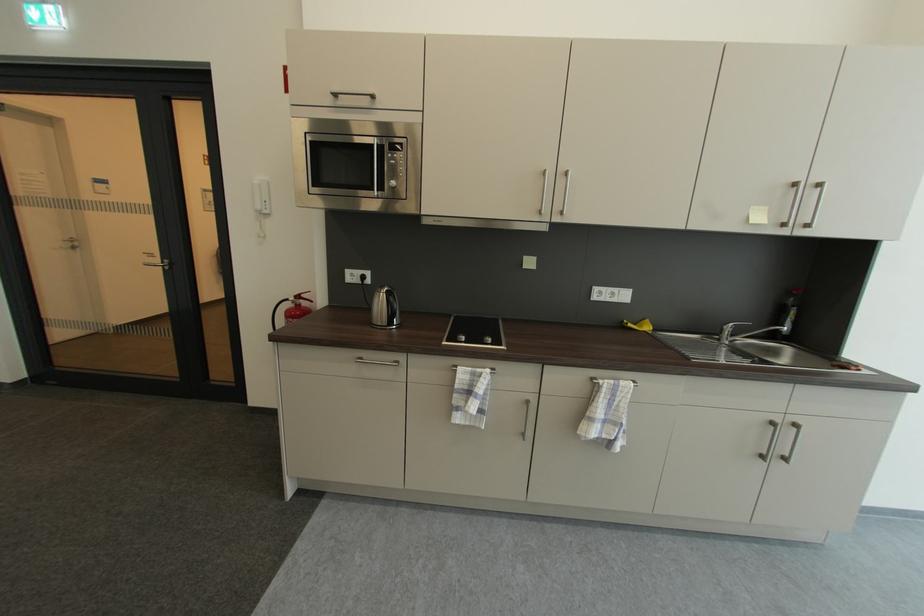
Find the location of a particular element. The image size is (924, 616). silver door handle is located at coordinates (157, 264).